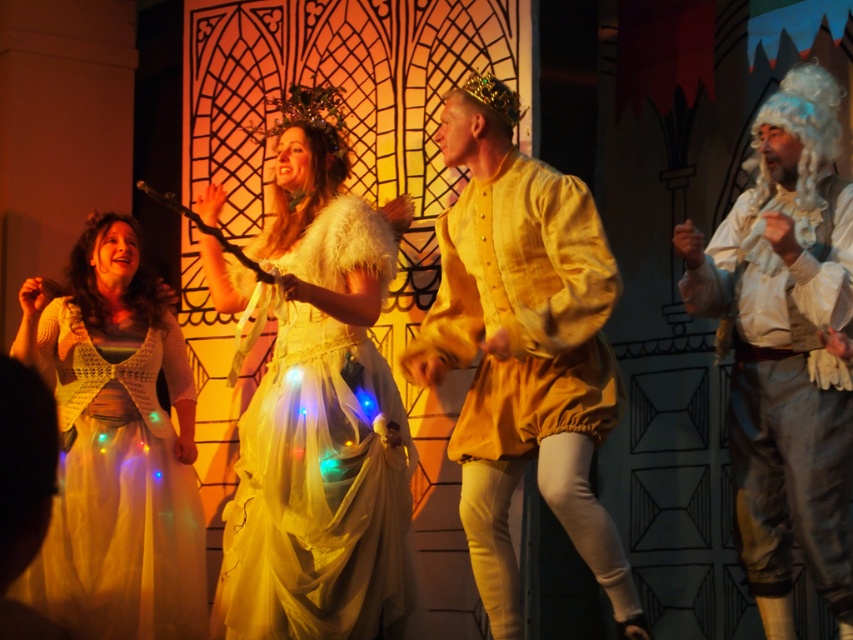
Who is positioned more to the right, white satin wig at right or white lace dress at left?

From the viewer's perspective, white satin wig at right appears more on the right side.

Does white satin wig at right have a lesser height compared to white lace dress at left?

Incorrect, white satin wig at right's height does not fall short of white lace dress at left's.

Is point (747, 392) less distant than point (173, 548)?

Yes, it is in front of point (173, 548).

Where is `white satin wig at right`? The image size is (853, 640). white satin wig at right is located at coordinates (786, 348).

What do you see at coordinates (523, 349) in the screenshot?
I see `matte yellow fabric shirt at center` at bounding box center [523, 349].

Can you confirm if matte yellow fabric shirt at center is bigger than white satin wig at right?

Yes.

Does point (581, 524) come closer to viewer compared to point (811, 403)?

That is True.

Where is `matte yellow fabric shirt at center`? The image size is (853, 640). matte yellow fabric shirt at center is located at coordinates (523, 349).

Looking at this image, between ivory satin dress at center and white lace dress at left, which one has less height?

Standing shorter between the two is ivory satin dress at center.

Is ivory satin dress at center bigger than white lace dress at left?

No.

Is point (318, 276) positioned after point (136, 241)?

No, (318, 276) is closer to viewer.

Locate an element on the screen. This screenshot has height=640, width=853. ivory satin dress at center is located at coordinates (320, 410).